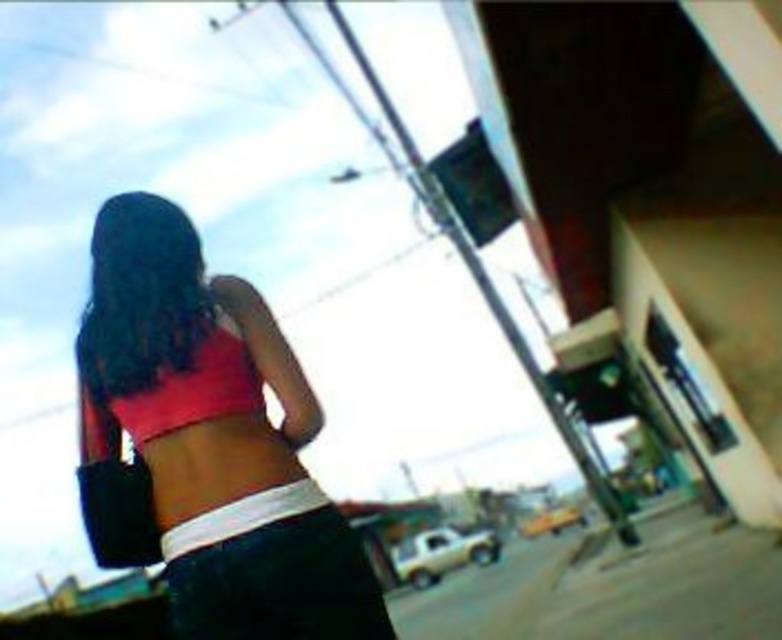
You are a photographer trying to capture the pink fabric top at center in your shot. Based on its coordinates, where should you position your camera to ensure it is centered in the frame?

The pink fabric top at center is already positioned at the coordinates given, so centering the camera on those coordinates would ensure it is centered in the frame.

You are a fashion designer observing a person at a gas station. You notice two pink tops on them. Which one is wider? The pink fabric top at center or the pink matte bikini top at center?

The pink fabric top at center is wider than the pink matte bikini top at center according to the description.